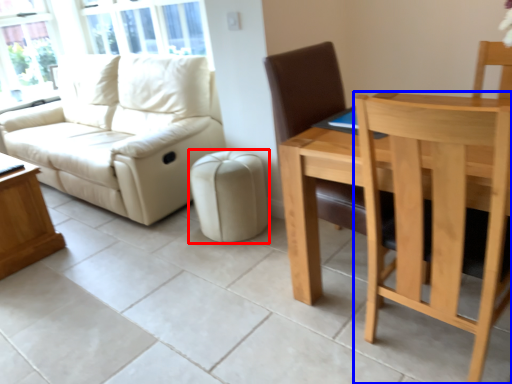
Question: Which object is closer to the camera taking this photo, stool (highlighted by a red box) or chair (highlighted by a blue box)?

Choices:
 (A) stool
 (B) chair

Answer: (B)